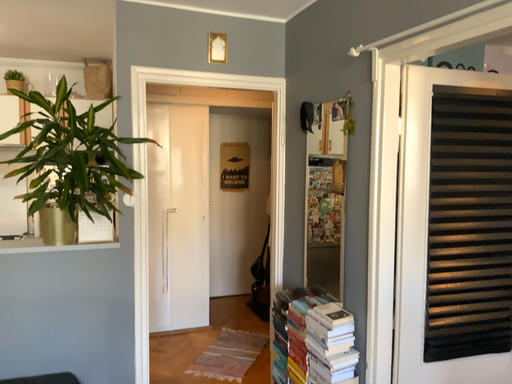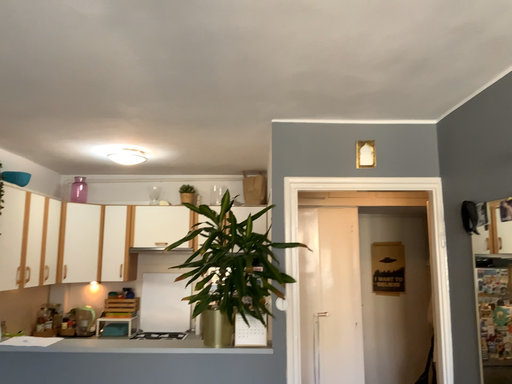
Question: Which way did the camera rotate in the video?

Choices:
 (A) rotated right
 (B) rotated left

Answer: (B)